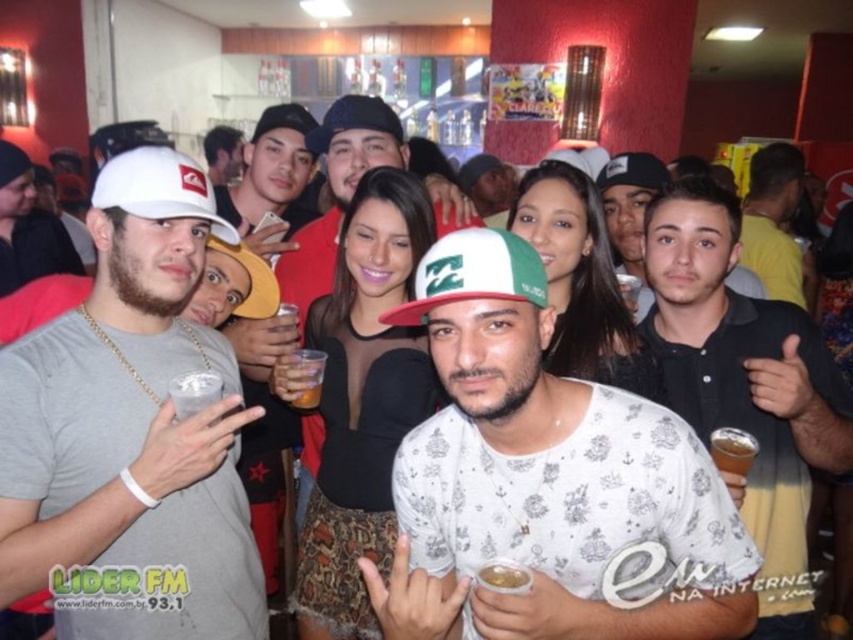
You are standing in the middle of the crowd at the bar and see two points in the image. The first point is at coordinates point [117,412] and the second is at point [338,97]. Which point is closer to you?

Point [117,412] is closer to the viewer than point [338,97].

Based on the scene description, where is the white cotton shirt at center located in terms of coordinates?

The white cotton shirt at center is located at point (543, 476).

You are at a party and want to hand a drink to the person wearing the white matte cap at left and the matte black baseball cap at center. Which person should you approach first if you start from the left side of the image?

You should approach the white matte cap at left first since it is positioned to the left of the matte black baseball cap at center.